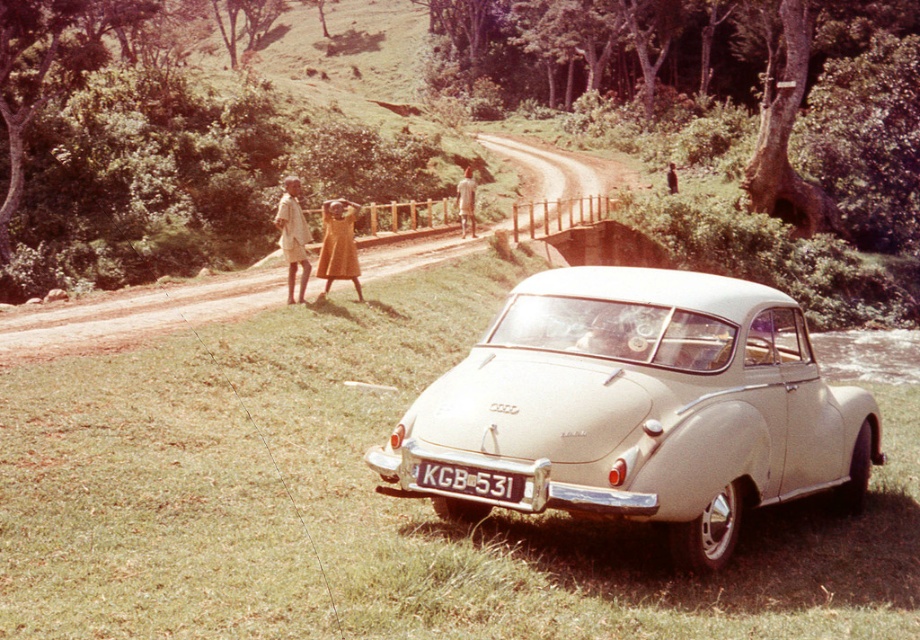
Question: Which point appears farthest from the camera in this image?

Choices:
 (A) (x=439, y=452)
 (B) (x=342, y=227)
 (C) (x=474, y=232)
 (D) (x=223, y=310)

Answer: (C)

Question: Is beige matte car at center to the right of brown dirt track at center from the viewer's perspective?

Choices:
 (A) yes
 (B) no

Answer: (A)

Question: Based on their relative distances, which object is nearer to the light brown fabric shirt at left?

Choices:
 (A) brown dirt track at center
 (B) golden fabric dress at center
 (C) beige matte car at center

Answer: (B)

Question: Which of these objects is positioned farthest from the light brown fabric shirt at left?

Choices:
 (A) white plastic license plate at center
 (B) beige matte car at center
 (C) brown dirt track at center
 (D) golden fabric dress at center

Answer: (C)

Question: Is brown dirt track at center above white plastic license plate at center?

Choices:
 (A) yes
 (B) no

Answer: (A)

Question: Can you confirm if beige matte car at center is wider than light brown fabric shirt at left?

Choices:
 (A) yes
 (B) no

Answer: (B)